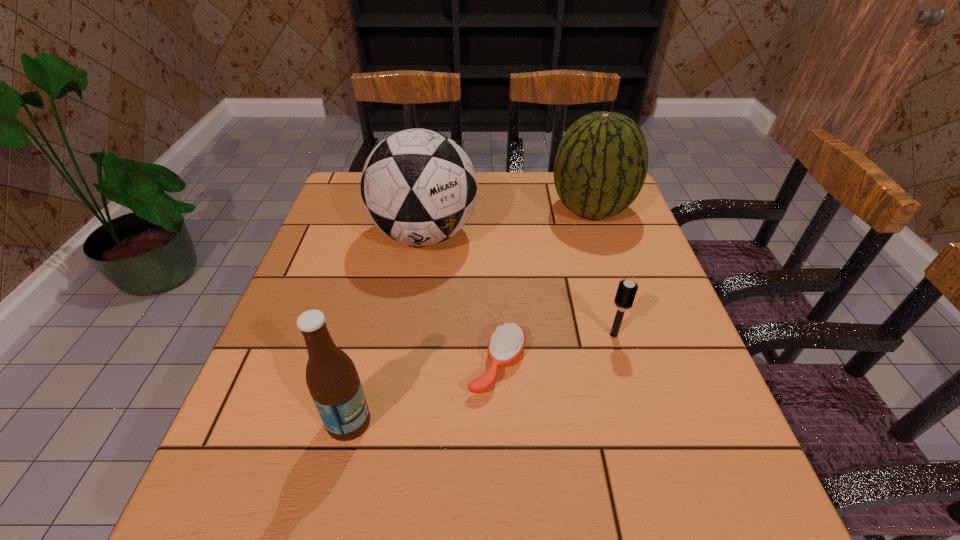
I want to click on free space at the far edge, so click(475, 211).

Where is `vacant region at the left edge of the desktop`? Image resolution: width=960 pixels, height=540 pixels. vacant region at the left edge of the desktop is located at coordinates (259, 400).

At what (x,y) coordinates should I click in order to perform the action: click on free space at the right edge of the desktop. Please return your answer as a coordinate pair (x, y). The image size is (960, 540). Looking at the image, I should click on tap(639, 273).

The width and height of the screenshot is (960, 540). What are the coordinates of `vacant area at the near right corner` in the screenshot? It's located at (658, 496).

Identify the location of vacant region between the nearest object and the shortest object. (423, 393).

The image size is (960, 540). I want to click on free spot between the soccer ball and the shortest object, so click(x=461, y=299).

Where is `empty space between the watermelon and the soccer ball`? The image size is (960, 540). empty space between the watermelon and the soccer ball is located at coordinates (508, 222).

In order to click on free area in between the fourth tallest object and the shorter hairbrush in this screenshot , I will do `click(556, 349)`.

Find the location of a particular element. The height and width of the screenshot is (540, 960). free spot between the beer bottle and the watermelon is located at coordinates (470, 316).

Identify the location of vacant area that lies between the watermelon and the beer bottle. (470, 316).